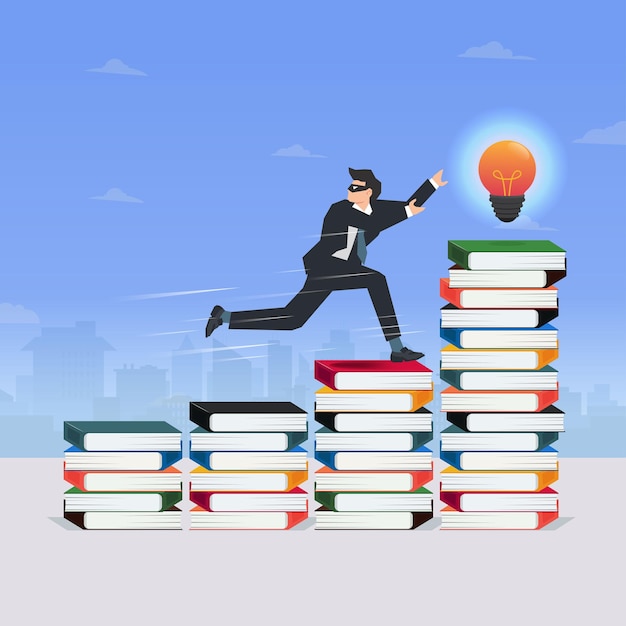
The image size is (626, 626). Find the location of `piles of books`. piles of books is located at coordinates (123, 491), (252, 483), (381, 468), (488, 451).